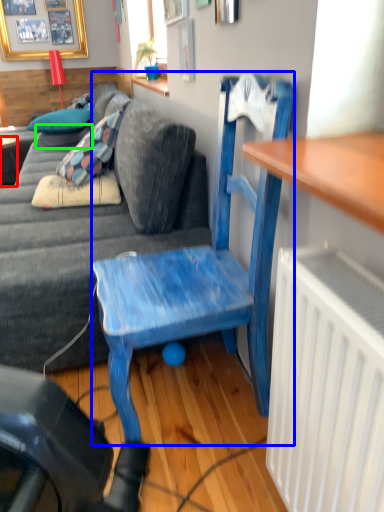
Question: Which object is the closest to the desk (highlighted by a red box)? Choose among these: chair (highlighted by a blue box) or pillow (highlighted by a green box).

Choices:
 (A) chair
 (B) pillow

Answer: (B)